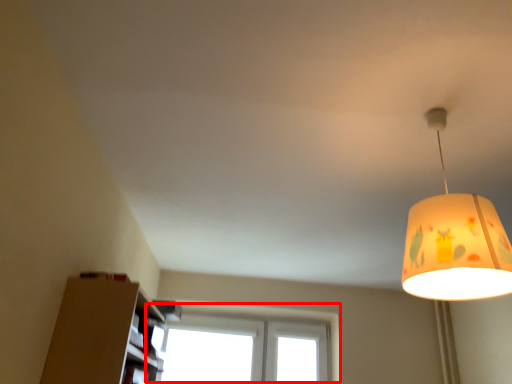
Question: Considering the relative positions of window (annotated by the red box) and lamp in the image provided, where is window (annotated by the red box) located with respect to the staircase?

Choices:
 (A) left
 (B) right

Answer: (A)